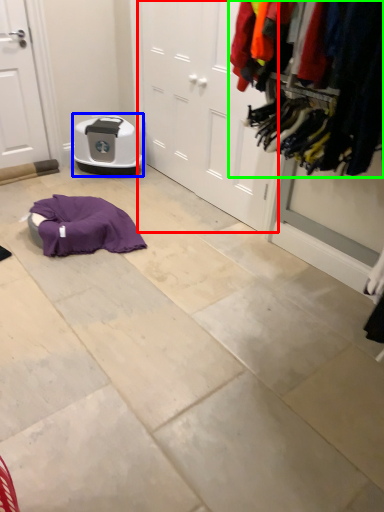
Question: Estimate the real-world distances between objects in this image. Which object is closer to door (highlighted by a red box), appliance (highlighted by a blue box) or closet (highlighted by a green box)?

Choices:
 (A) appliance
 (B) closet

Answer: (A)